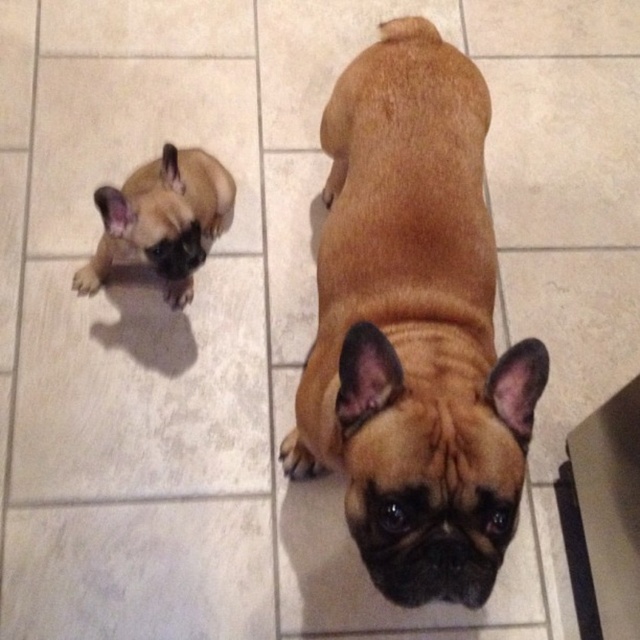
Question: Among these points, which one is nearest to the camera?

Choices:
 (A) (173, 272)
 (B) (486, 576)

Answer: (B)

Question: Can you confirm if brown matte dog at center is positioned below brown matte french bulldog at upper left?

Choices:
 (A) no
 (B) yes

Answer: (B)

Question: Can you confirm if brown matte dog at center is positioned to the left of brown matte french bulldog at upper left?

Choices:
 (A) no
 (B) yes

Answer: (A)

Question: In this image, where is brown matte dog at center located relative to brown matte french bulldog at upper left?

Choices:
 (A) below
 (B) above

Answer: (A)

Question: Which point is farther from the camera taking this photo?

Choices:
 (A) (362, 480)
 (B) (106, 220)

Answer: (B)